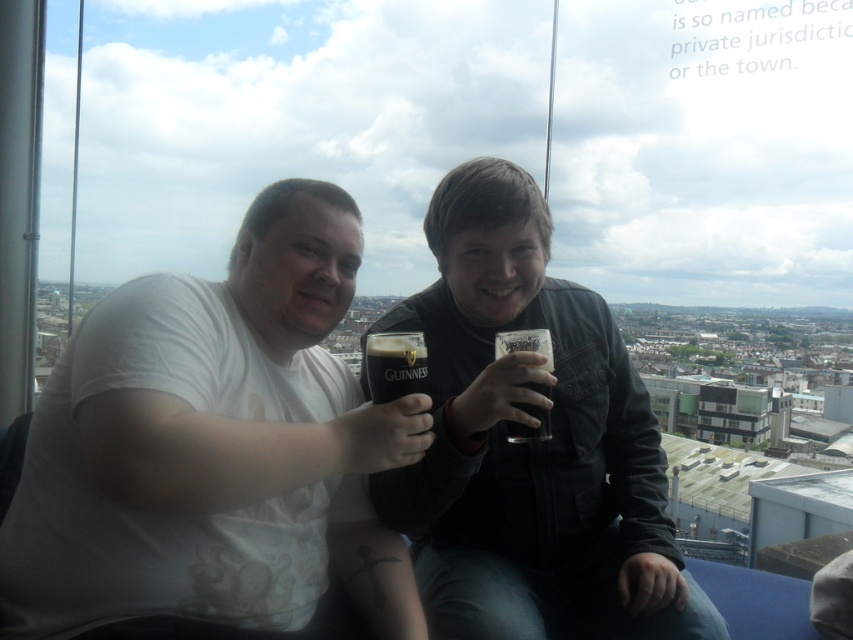
Question: Which object appears farthest from the camera in this image?

Choices:
 (A) dark brown glass at center
 (B) matte black jacket at center

Answer: (A)

Question: Is white matte t-shirt at left thinner than matte black jacket at center?

Choices:
 (A) yes
 (B) no

Answer: (B)

Question: Estimate the real-world distances between objects in this image. Which object is closer to the matte black jacket at center?

Choices:
 (A) dark brown glass at center
 (B) white matte t-shirt at left
 (C) guinness dark glass at center

Answer: (A)

Question: Does guinness dark glass at center appear under dark brown glass at center?

Choices:
 (A) no
 (B) yes

Answer: (A)

Question: Which point appears closest to the camera in this image?

Choices:
 (A) tap(535, 252)
 (B) tap(161, 502)
 (C) tap(421, 355)

Answer: (B)

Question: Considering the relative positions of white matte t-shirt at left and guinness dark glass at center in the image provided, where is white matte t-shirt at left located with respect to guinness dark glass at center?

Choices:
 (A) above
 (B) below

Answer: (B)